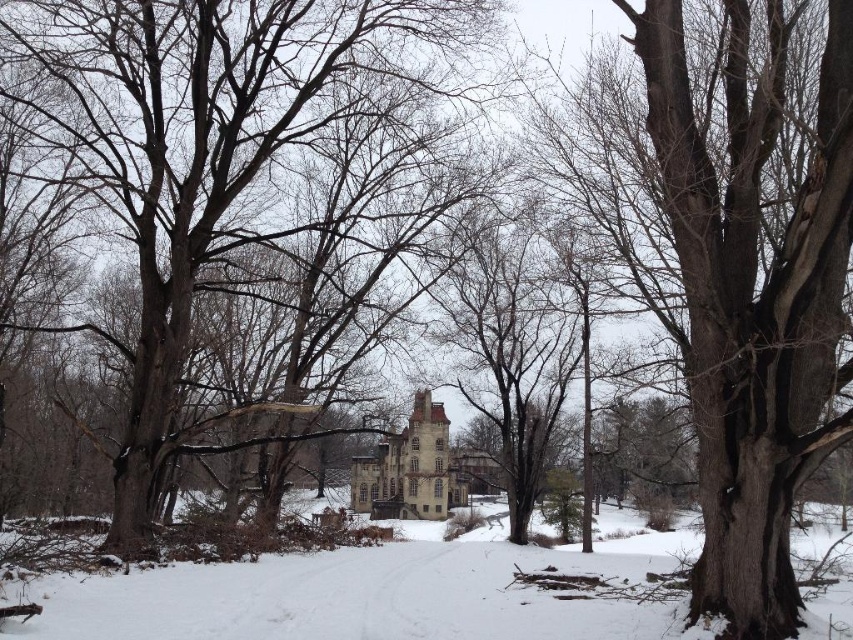
You are an observer standing at the edge of the snowy area. You see the smooth brown tree trunk at center and the white powdery snow at center. Which object is taller?

The smooth brown tree trunk at center is much taller than the white powdery snow at center.

You are standing in the winter scene and want to determine which object occupies more space in the image. Based on the scene, which is larger in size between the smooth brown tree trunk at center and the white powdery snow at center?

The smooth brown tree trunk at center is larger in size than the white powdery snow at center according to the description.